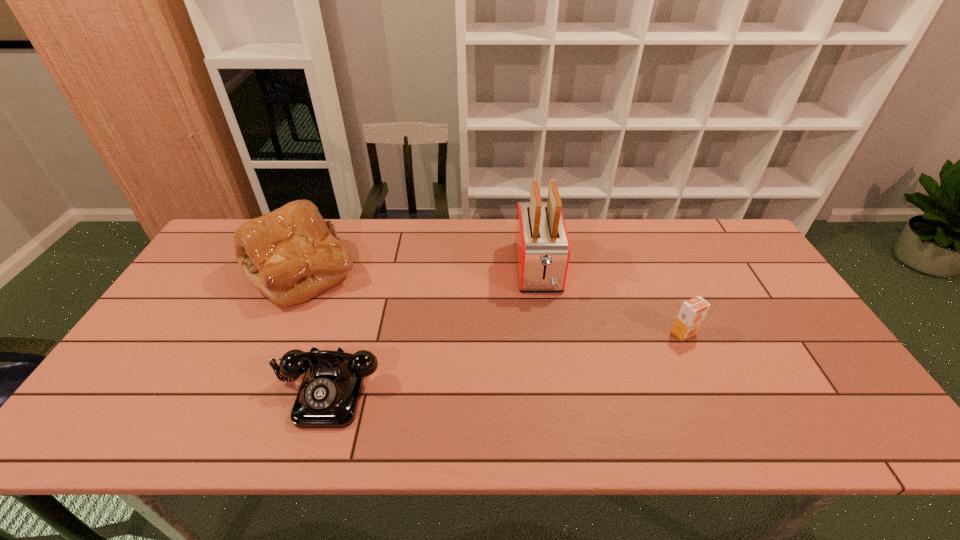
You are a GUI agent. You are given a task and a screenshot of the screen. Output one action in this format:
    pyautogui.click(x=<x>, y=<y>)
    Task: Click on the tallest object
    This screenshot has height=540, width=960.
    Given the screenshot: What is the action you would take?
    pyautogui.click(x=542, y=246)

Find the location of `toaster`. toaster is located at coordinates (542, 246).

You are a GUI agent. You are given a task and a screenshot of the screen. Output one action in this format:
    pyautogui.click(x=<x>, y=<y>)
    Task: Click on the third shortest object
    
    Given the screenshot: What is the action you would take?
    pyautogui.click(x=291, y=254)

Image resolution: width=960 pixels, height=540 pixels. I want to click on the third farthest object, so click(x=693, y=311).

Identify the location of the rightmost object. (693, 311).

The width and height of the screenshot is (960, 540). Identify the location of the nearest object. pos(328,397).

Identify the location of vacant region located 0.050m on the front-facing side of the toaster. This screenshot has width=960, height=540. (544, 312).

Locate an element on the screen. free space located 0.350m on the filling side of the third shortest object is located at coordinates (473, 271).

Find the location of `free spot located 0.130m on the front of the rightmost object`. free spot located 0.130m on the front of the rightmost object is located at coordinates (707, 383).

What are the coordinates of `toaster situated at the far edge` in the screenshot? It's located at (542, 246).